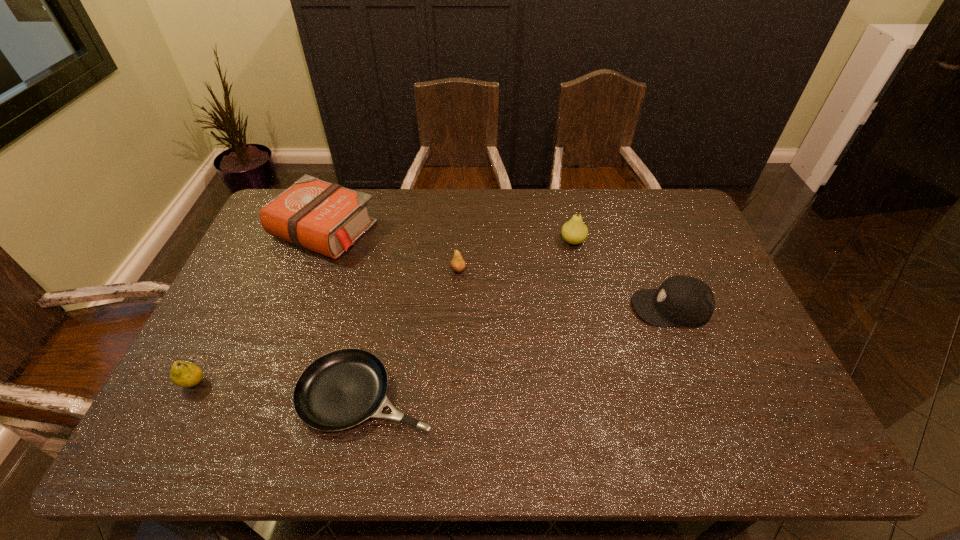
Locate an element on the screen. Image resolution: width=960 pixels, height=540 pixels. the farthest pear is located at coordinates (574, 231).

The width and height of the screenshot is (960, 540). In order to click on the tallest pear in this screenshot , I will do `click(574, 231)`.

The height and width of the screenshot is (540, 960). What are the coordinates of `Bible` in the screenshot? It's located at (327, 218).

The width and height of the screenshot is (960, 540). I want to click on the third nearest object, so click(686, 301).

I want to click on cap, so click(x=686, y=301).

Find the location of `the second farthest pear`. the second farthest pear is located at coordinates (457, 264).

Identify the location of the fourth object from left to right. The image size is (960, 540). (457, 264).

Locate an element on the screen. This screenshot has height=540, width=960. the nearest pear is located at coordinates (184, 374).

This screenshot has width=960, height=540. Identify the location of pan. (341, 389).

At what (x,y) coordinates should I click in order to perform the action: click on vacant space situated 0.190m on the back of the rightmost pear. Please return your answer as a coordinate pair (x, y). Image resolution: width=960 pixels, height=540 pixels. Looking at the image, I should click on point(564,200).